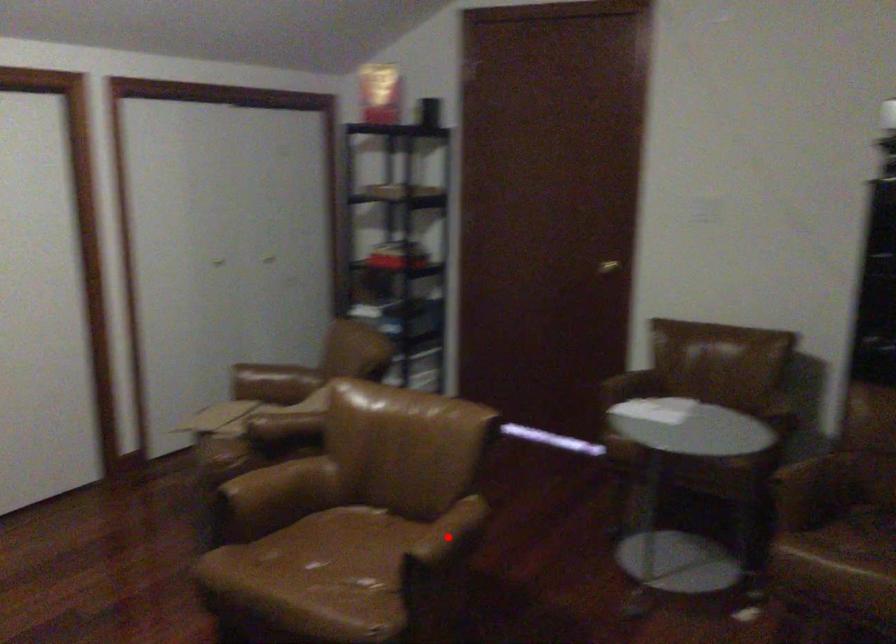
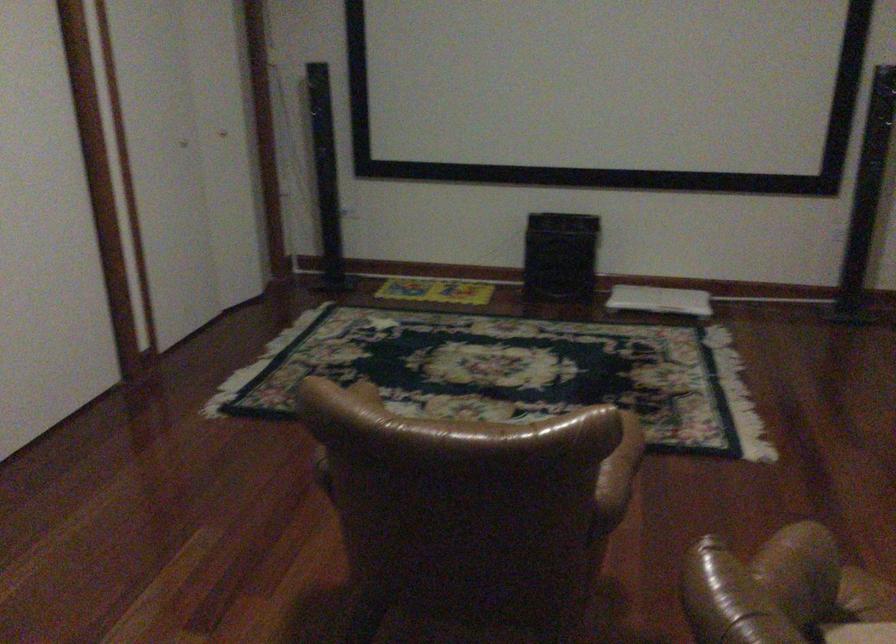
Question: I am providing you with two images of the same scene from different viewpoints. A red point is marked on the first image. At the location where the point appears in image 1, is it still visible in image 2?

Choices:
 (A) Yes
 (B) No

Answer: (B)